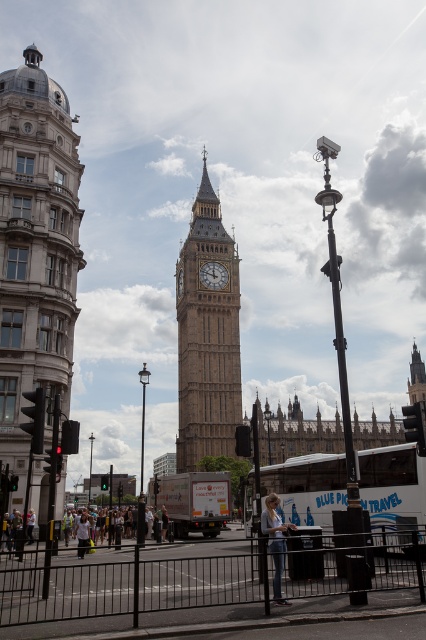
Question: Which object is closer to the camera taking this photo?

Choices:
 (A) white cotton shirt at center
 (B) denim jeans at lower center
 (C) stone clock tower at center

Answer: (B)

Question: Which of the following is the closest to the observer?

Choices:
 (A) (241, 410)
 (B) (124, 534)
 (C) (275, 582)

Answer: (C)

Question: Is denim jeans at lower center thinner than white cotton shirt at center?

Choices:
 (A) yes
 (B) no

Answer: (A)

Question: Which point is closer to the camera?

Choices:
 (A) silver metallic building at left
 (B) stone clock tower at center

Answer: (A)

Question: Is the position of white cotton shirt at center more distant than that of stone clock tower at center?

Choices:
 (A) no
 (B) yes

Answer: (A)

Question: Is silver metallic building at left bigger than golden stone clock tower at center?

Choices:
 (A) yes
 (B) no

Answer: (B)